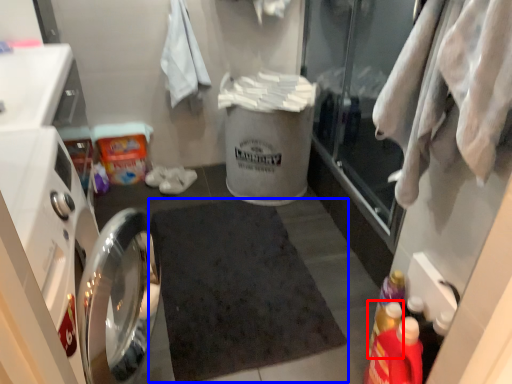
Question: Which object is closer to the camera taking this photo, bottle (highlighted by a red box) or bath mat (highlighted by a blue box)?

Choices:
 (A) bottle
 (B) bath mat

Answer: (A)